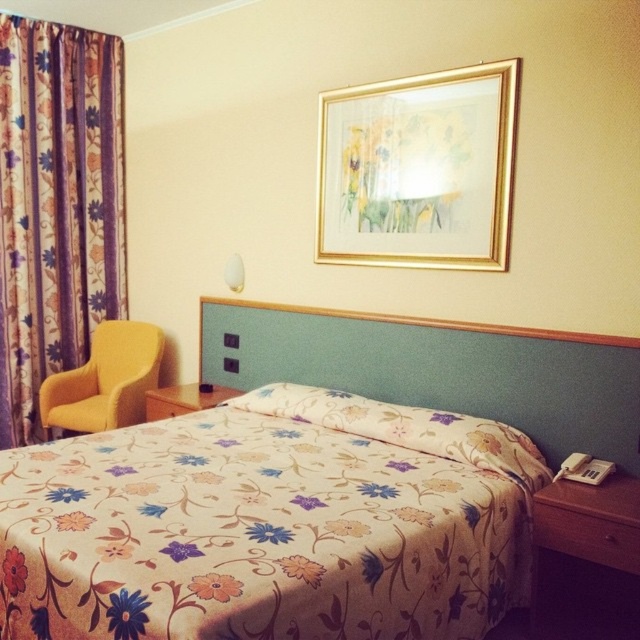
Question: Is floral fabric pillow at center wider than orange fabric flower at center?

Choices:
 (A) yes
 (B) no

Answer: (A)

Question: Which object appears closest to the camera in this image?

Choices:
 (A) yellow fabric armchair at left
 (B) white plastic lampshade at upper center

Answer: (A)

Question: Which object is closer to the camera taking this photo?

Choices:
 (A) floral fabric curtain at left
 (B) floral fabric bedspread at center
 (C) yellow fabric armchair at left

Answer: (B)

Question: Based on their relative distances, which object is farther from the floral fabric pillow at center?

Choices:
 (A) floral-patterned fabric at center
 (B) floral fabric bedspread at center

Answer: (B)

Question: From the image, what is the correct spatial relationship of floral fabric curtain at left in relation to floral fabric bedspread at center?

Choices:
 (A) right
 (B) left

Answer: (B)

Question: Is blue fabric flower at lower left to the left of floral fabric bedspread at lower left from the viewer's perspective?

Choices:
 (A) no
 (B) yes

Answer: (A)